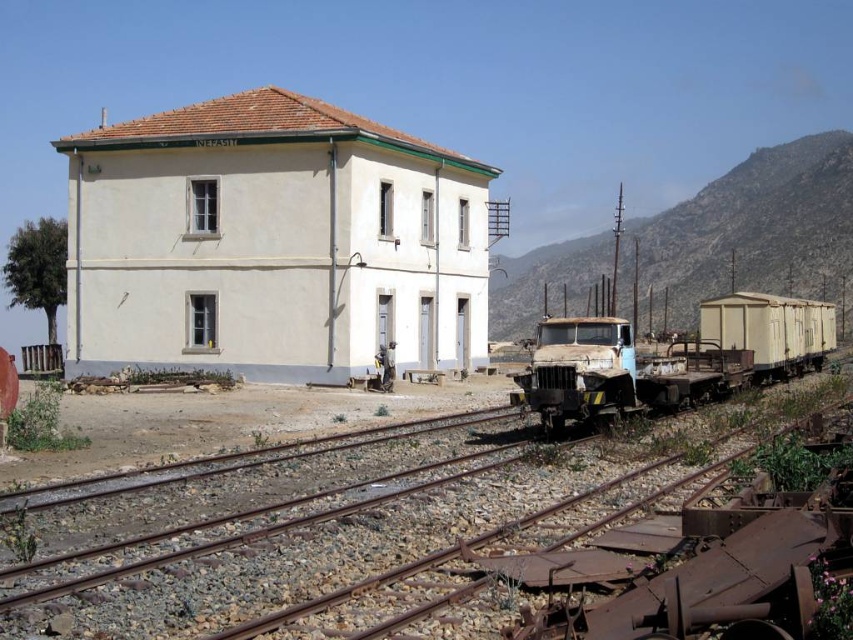
Question: Can you confirm if rusty metal tracks at center is smaller than rusty metal train at center?

Choices:
 (A) no
 (B) yes

Answer: (B)

Question: Can you confirm if rusty metal tracks at center is positioned to the right of rusty metal train at center?

Choices:
 (A) no
 (B) yes

Answer: (A)

Question: Is rusty metal tracks at center positioned before rusty metal train at center?

Choices:
 (A) no
 (B) yes

Answer: (B)